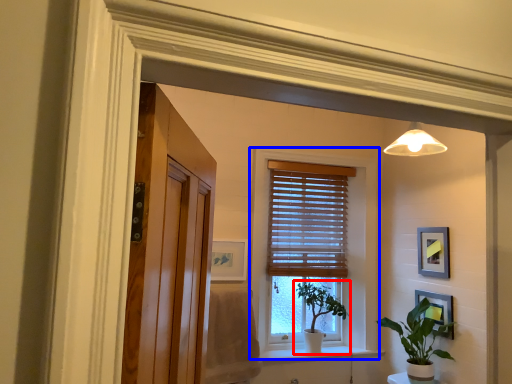
Question: Which object is closer to the camera taking this photo, houseplant (highlighted by a red box) or window (highlighted by a blue box)?

Choices:
 (A) houseplant
 (B) window

Answer: (B)